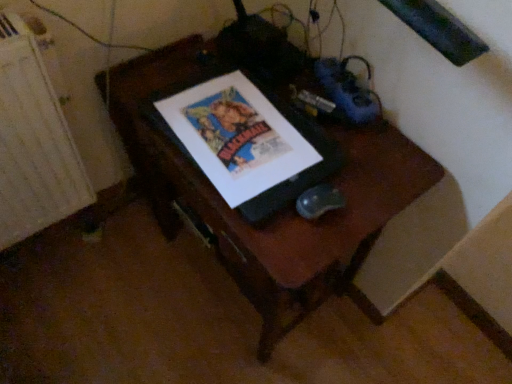
The width and height of the screenshot is (512, 384). What do you see at coordinates (277, 214) in the screenshot? I see `wooden desk at center` at bounding box center [277, 214].

The image size is (512, 384). In order to click on white textured radiator at left in this screenshot , I will do `click(35, 135)`.

Identify the location of matte paper poster at center. The width and height of the screenshot is (512, 384). (237, 137).

Identify the location of radiator in front of the matte paper poster at center. Image resolution: width=512 pixels, height=384 pixels. (35, 135).

Considering the points (1, 114) and (181, 100), which point is in front, point (1, 114) or point (181, 100)?

Point (181, 100)

Is white textured radiator at left bigger or smaller than matte paper poster at center?

In the image, white textured radiator at left appears to be larger than matte paper poster at center.

Who is bigger, white textured radiator at left or wooden desk at center?

Bigger between the two is wooden desk at center.

Locate an element on the screen. The width and height of the screenshot is (512, 384). furniture lying on the right of white textured radiator at left is located at coordinates (277, 214).

How far apart are white textured radiator at left and wooden desk at center?

white textured radiator at left is 15.04 inches away from wooden desk at center.

In the image, is wooden desk at center positioned in front of or behind matte paper poster at center?

Visually, wooden desk at center is located in front of matte paper poster at center.

Visually, is wooden desk at center positioned to the left or to the right of matte paper poster at center?

wooden desk at center is to the right of matte paper poster at center.

Where is `comic book above the wooden desk at center (from a real-world perspective)`? This screenshot has width=512, height=384. comic book above the wooden desk at center (from a real-world perspective) is located at coordinates (237, 137).

From the image's perspective, is wooden desk at center beneath matte paper poster at center?

Yes, from the image's perspective, wooden desk at center is below matte paper poster at center.

Does matte paper poster at center have a greater height compared to white textured radiator at left?

No.

From a real-world perspective, which is physically below, matte paper poster at center or white textured radiator at left?

In real-world perspective, white textured radiator at left is lower.

Which is closer, (x=209, y=95) or (x=31, y=219)?

Point (x=209, y=95) appears to be closer to the viewer than point (x=31, y=219).

Considering the relative sizes of matte paper poster at center and white textured radiator at left in the image provided, is matte paper poster at center wider than white textured radiator at left?

Indeed, matte paper poster at center has a greater width compared to white textured radiator at left.

Which is in front, point (285, 322) or point (3, 97)?

The point (3, 97) is more forward.

Who is smaller, wooden desk at center or white textured radiator at left?

With smaller size is white textured radiator at left.

Is wooden desk at center further to the viewer compared to white textured radiator at left?

No, wooden desk at center is in front of white textured radiator at left.

Is wooden desk at center next to white textured radiator at left and touching it?

No, wooden desk at center is not making contact with white textured radiator at left.

Based on the photo, is matte paper poster at center completely or partially outside of wooden desk at center?

Yes, matte paper poster at center is outside of wooden desk at center.

From a real-world perspective, is matte paper poster at center physically located above or below wooden desk at center?

Clearly, from a real-world perspective, matte paper poster at center is above wooden desk at center.

Could you tell me if matte paper poster at center is facing wooden desk at center?

No, matte paper poster at center does not turn towards wooden desk at center.

Where is `comic book above the white textured radiator at left (from the image's perspective)`? comic book above the white textured radiator at left (from the image's perspective) is located at coordinates (237, 137).

Identify the location of radiator lying on the left of wooden desk at center. Image resolution: width=512 pixels, height=384 pixels. click(x=35, y=135).

From the image, which object appears to be farther from matte paper poster at center, wooden desk at center or white textured radiator at left?

Based on the image, white textured radiator at left appears to be further to matte paper poster at center.

Considering their positions, is white textured radiator at left positioned closer to matte paper poster at center than wooden desk at center?

wooden desk at center is closer to matte paper poster at center.

Estimate the real-world distances between objects in this image. Which object is further from white textured radiator at left, matte paper poster at center or wooden desk at center?

Based on the image, matte paper poster at center appears to be further to white textured radiator at left.

Considering their positions, is wooden desk at center positioned closer to white textured radiator at left than matte paper poster at center?

wooden desk at center is positioned closer to the anchor white textured radiator at left.

Estimate the real-world distances between objects in this image. Which object is further from wooden desk at center, white textured radiator at left or matte paper poster at center?

Based on the image, white textured radiator at left appears to be further to wooden desk at center.

Estimate the real-world distances between objects in this image. Which object is further from wooden desk at center, matte paper poster at center or white textured radiator at left?

The object further to wooden desk at center is white textured radiator at left.

Identify the location of comic book situated between white textured radiator at left and wooden desk at center from left to right. The width and height of the screenshot is (512, 384). (237, 137).